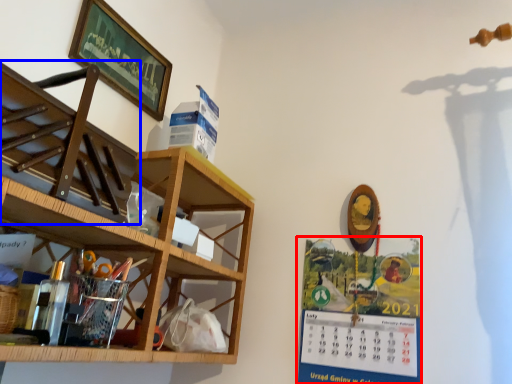
Question: Among these objects, which one is nearest to the camera, poster (highlighted by a red box) or shelf (highlighted by a blue box)?

Choices:
 (A) poster
 (B) shelf

Answer: (B)